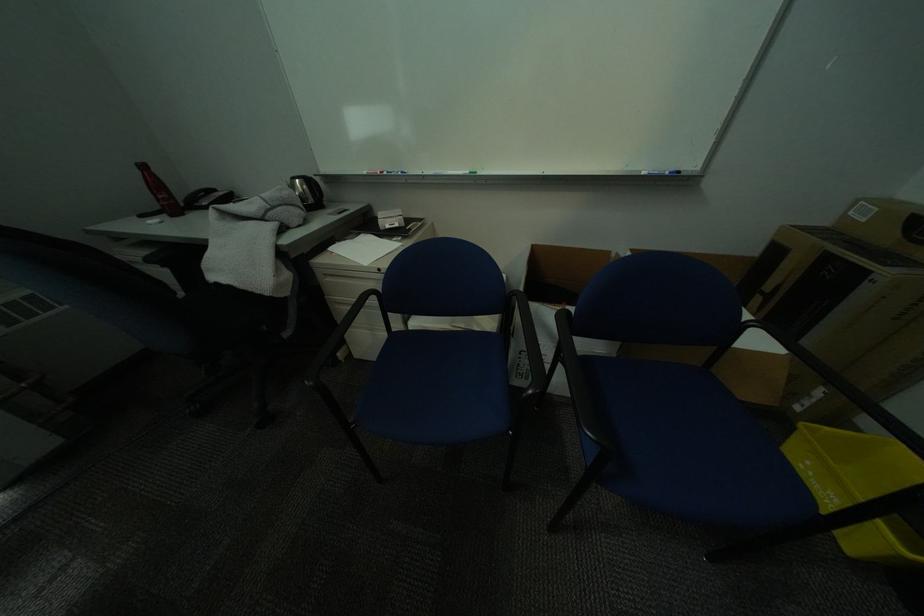
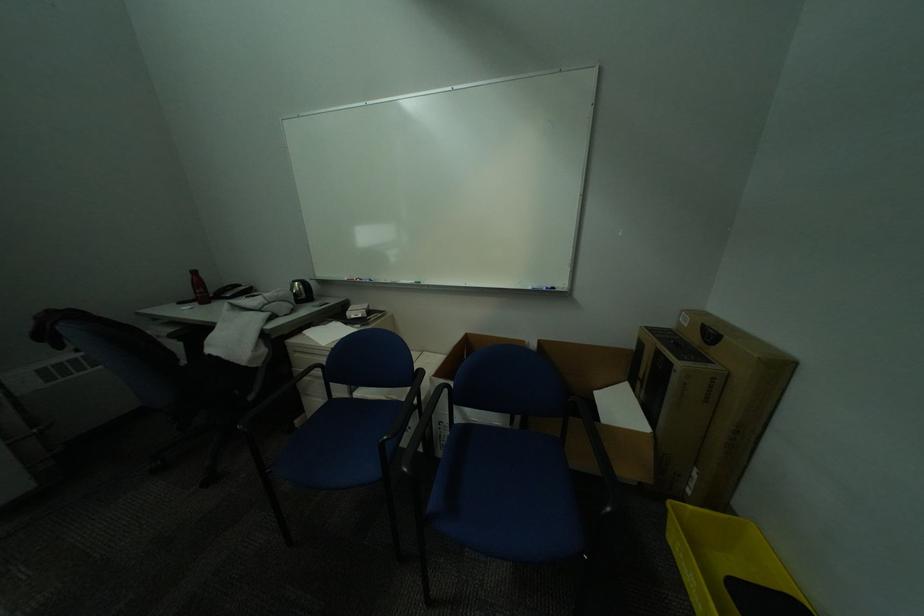
Question: How did the camera likely rotate?

Choices:
 (A) Left
 (B) Right
 (C) Up
 (D) Down

Answer: (C)